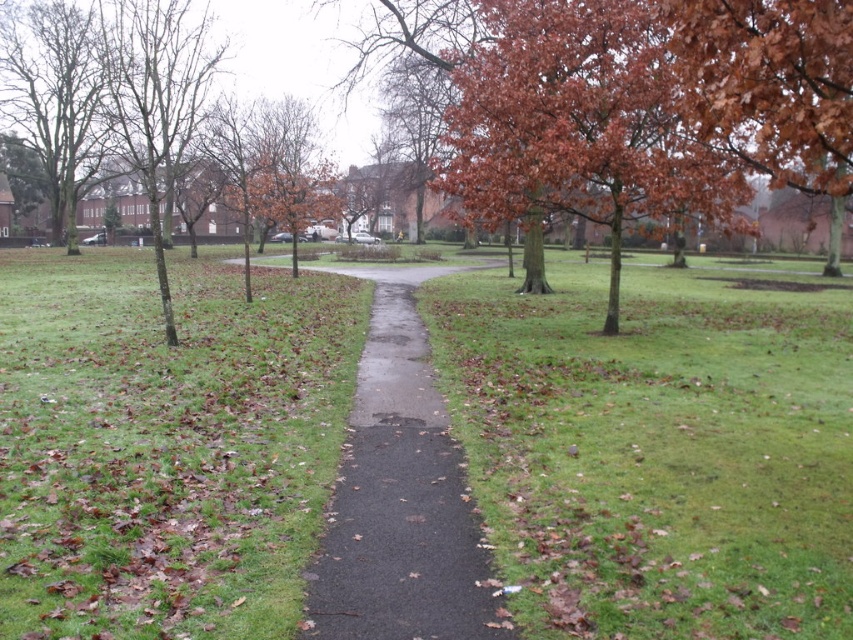
Question: Does green grassy at center appear under brown leafy tree at upper center?

Choices:
 (A) yes
 (B) no

Answer: (A)

Question: Which point appears farthest from the camera in this image?

Choices:
 (A) (804, 172)
 (B) (370, 566)
 (C) (724, 428)
 (D) (6, 253)

Answer: (D)

Question: Does green grass at center lie behind black asphalt path at center?

Choices:
 (A) no
 (B) yes

Answer: (A)

Question: Which is farther from the brown leafy tree at upper center?

Choices:
 (A) green grass at center
 (B) black asphalt path at center
 (C) green grassy at center

Answer: (B)

Question: Which object is positioned closest to the black asphalt path at center?

Choices:
 (A) green grass at center
 (B) brown leafy tree at upper center

Answer: (A)

Question: Is brown leafy tree at upper center in front of black asphalt path at center?

Choices:
 (A) no
 (B) yes

Answer: (A)